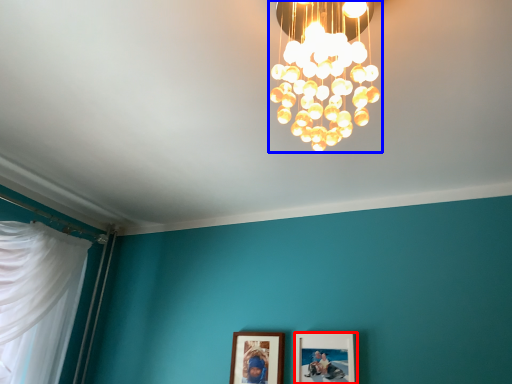
Question: Which object is further to the camera taking this photo, picture frame (highlighted by a red box) or lamp (highlighted by a blue box)?

Choices:
 (A) picture frame
 (B) lamp

Answer: (A)